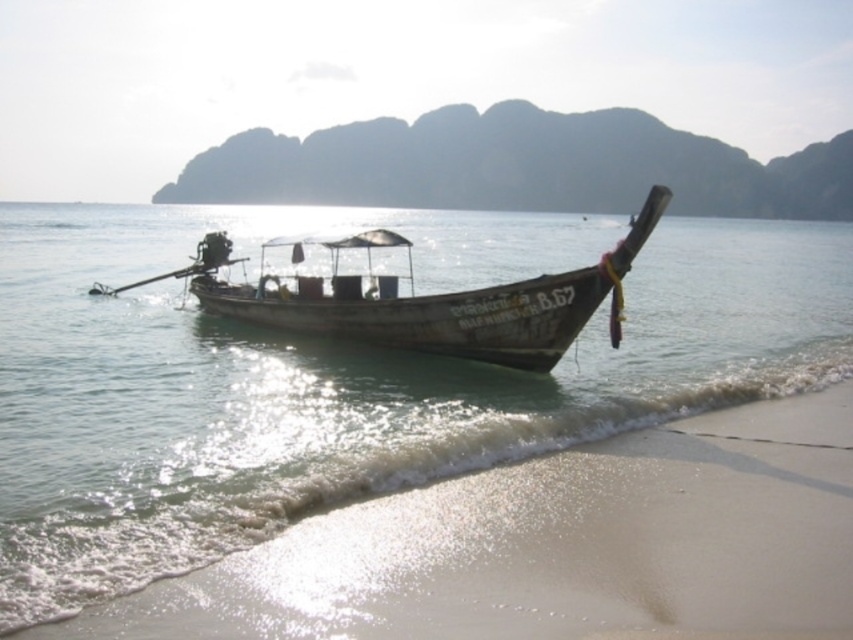
Can you confirm if translucent water at boat center is positioned to the left of wooden boat at center?

Incorrect, translucent water at boat center is not on the left side of wooden boat at center.

How far apart are translucent water at boat center and wooden boat at center?

translucent water at boat center is 39.51 meters away from wooden boat at center.

Between point (119, 401) and point (209, 298), which one is positioned behind?

The point (209, 298) is more distant.

The width and height of the screenshot is (853, 640). In order to click on translucent water at boat center in this screenshot , I will do `click(341, 378)`.